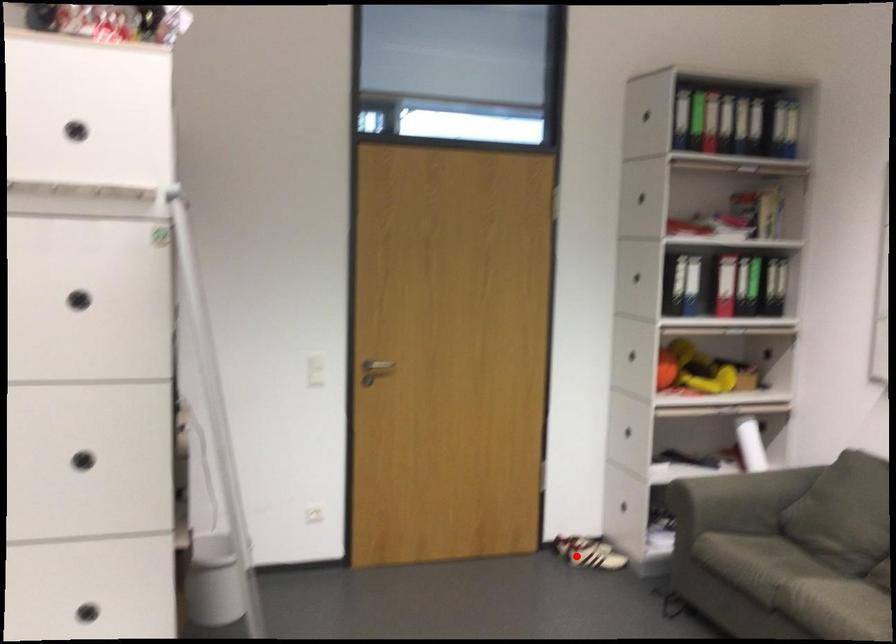
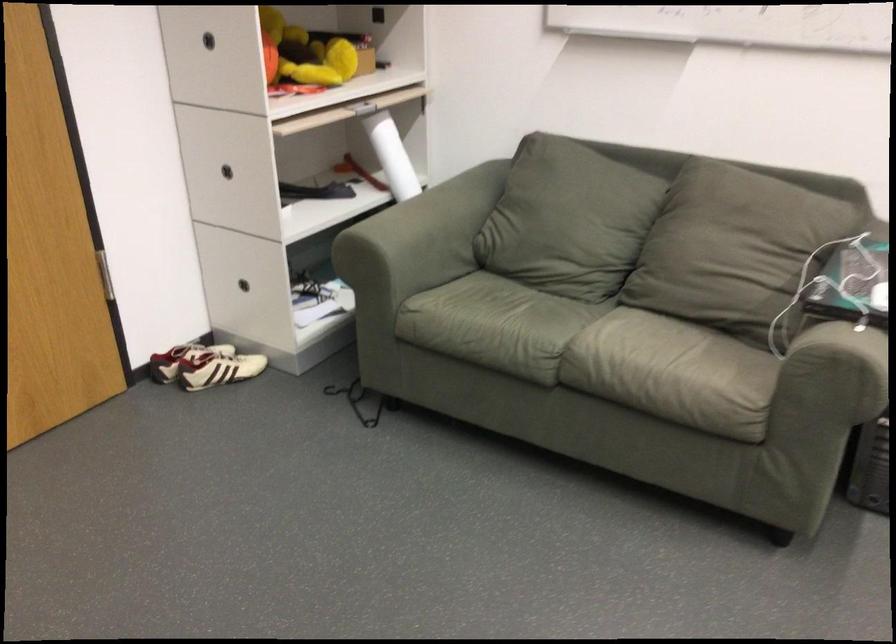
Question: I am providing you with two images of the same scene from different viewpoints. Given a red point in image1, look at the same physical point in image2. Is it:

Choices:
 (A) Closer to the viewpoint
 (B) Farther from the viewpoint

Answer: (A)